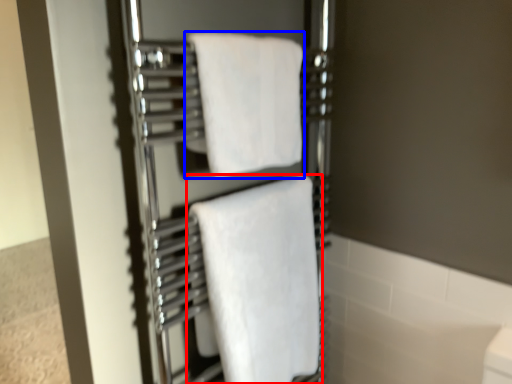
Question: Among these objects, which one is farthest to the camera, towel (highlighted by a red box) or towel (highlighted by a blue box)?

Choices:
 (A) towel
 (B) towel

Answer: (A)